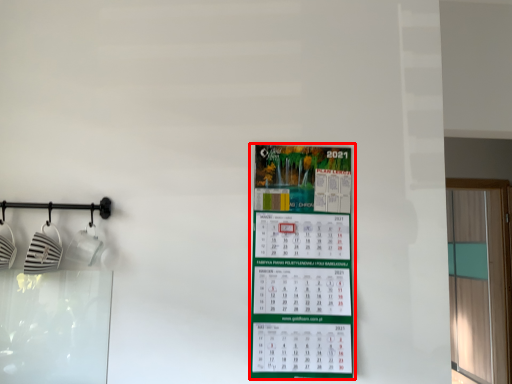
Question: From the image's perspective, what is the correct spatial positioning of poster (annotated by the red box) in reference to window?

Choices:
 (A) above
 (B) below

Answer: (A)